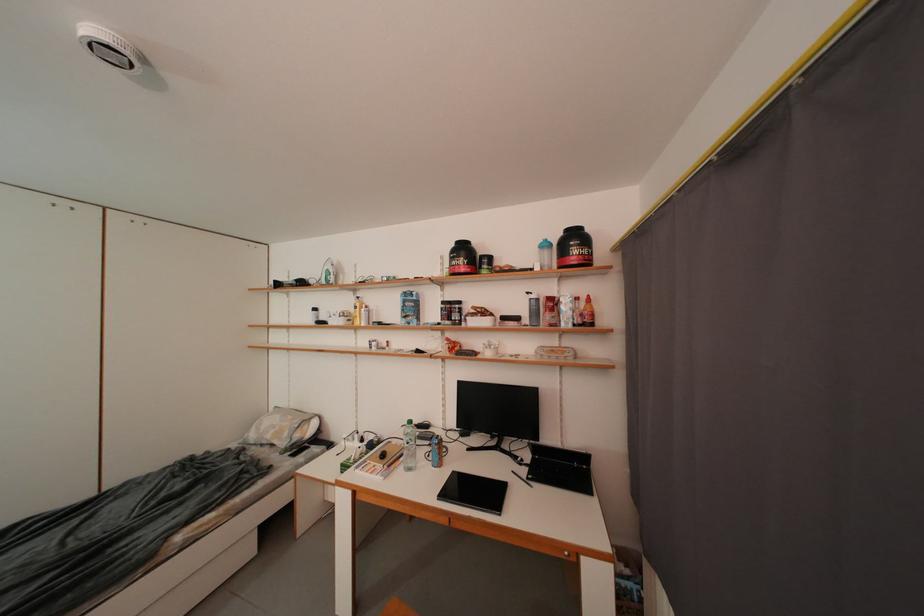
Image resolution: width=924 pixels, height=616 pixels. Describe the element at coordinates (408, 446) in the screenshot. I see `the patterned water bottle` at that location.